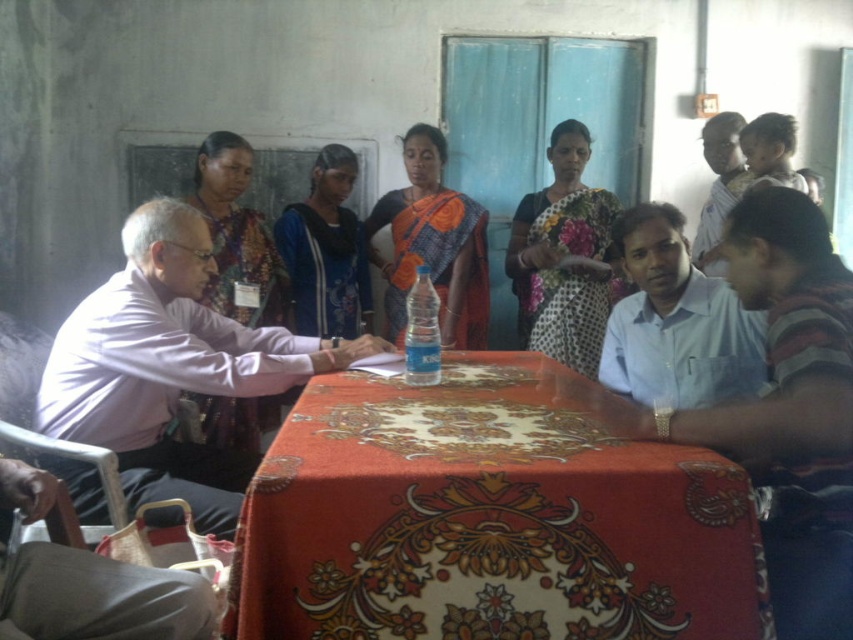
You are organizing a photo shoot and need to ensure that all clothing items in the scene are visible. Given that the light blue shirt at center and the printed fabric saree at center are both central to the composition, which clothing item has a narrower width?

The light blue shirt at center has a narrower width compared to the printed fabric saree at center.